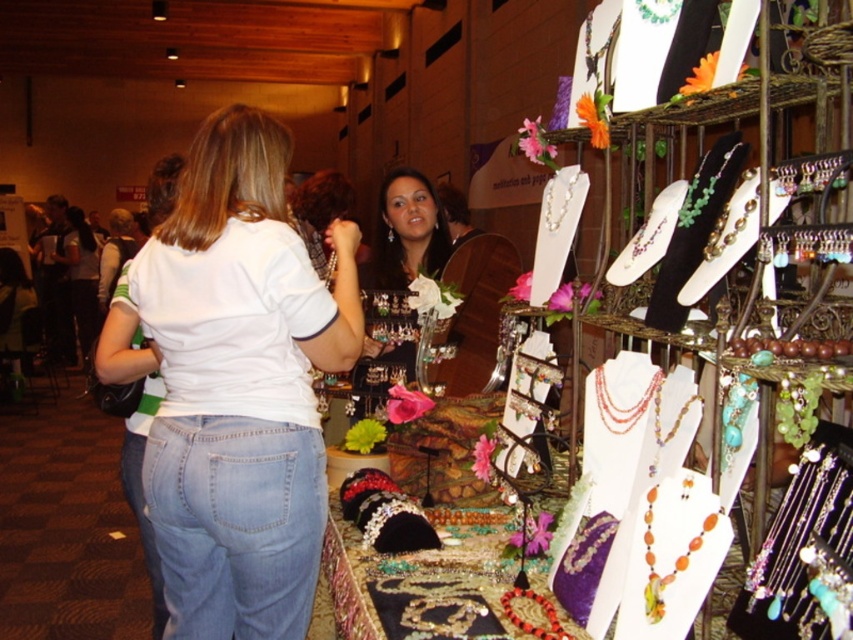
Can you confirm if blue denim jeans at lower left is shorter than white matte shirt at center?

Indeed, blue denim jeans at lower left has a lesser height compared to white matte shirt at center.

From the picture: Does blue denim jeans at lower left have a smaller size compared to white matte shirt at center?

Correct, blue denim jeans at lower left occupies less space than white matte shirt at center.

You are a GUI agent. You are given a task and a screenshot of the screen. Output one action in this format:
    pyautogui.click(x=<x>, y=<y>)
    Task: Click on the blue denim jeans at lower left
    Image resolution: width=853 pixels, height=640 pixels.
    Given the screenshot: What is the action you would take?
    pyautogui.click(x=142, y=522)

Identify the location of blue denim jeans at lower left. (142, 522).

Which is more to the left, multicolored beaded necklace at upper right or matte black necklace at center?

Positioned to the left is matte black necklace at center.

Consider the image. Does multicolored beaded necklace at upper right have a smaller size compared to matte black necklace at center?

Correct, multicolored beaded necklace at upper right occupies less space than matte black necklace at center.

Find the location of `multicolored beaded necklace at upper right`. multicolored beaded necklace at upper right is located at coordinates (647, 243).

At what (x,y) coordinates should I click in order to perform the action: click on multicolored beaded necklace at upper right. Please return your answer as a coordinate pair (x, y). Looking at the image, I should click on pyautogui.click(x=647, y=243).

Based on the photo, measure the distance between white matte shirt at upper left and camera.

A distance of 8.26 meters exists between white matte shirt at upper left and camera.

Who is higher up, white matte shirt at upper left or blue denim jeans at lower left?

white matte shirt at upper left is higher up.

Who is more distant from viewer, (x=86, y=257) or (x=154, y=602)?

Positioned behind is point (x=86, y=257).

Where is `white matte shirt at upper left`? white matte shirt at upper left is located at coordinates point(80,276).